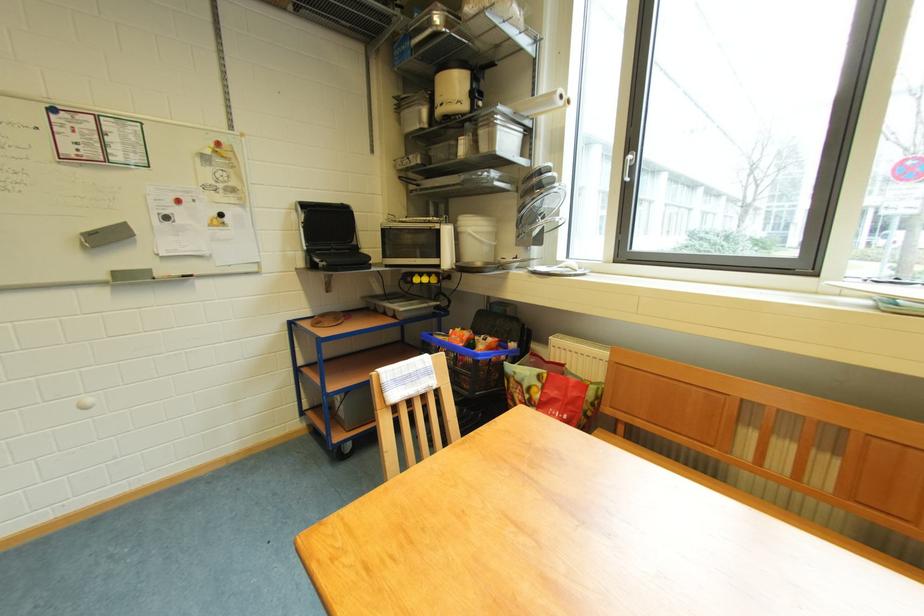
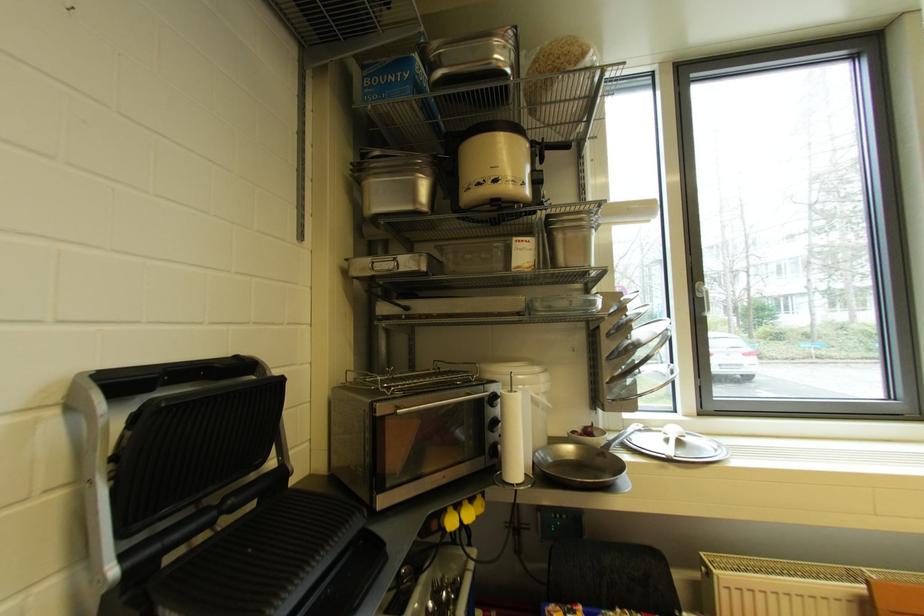
In the second image, find the point that corresponds to point 419,58 in the first image.

(420, 97)